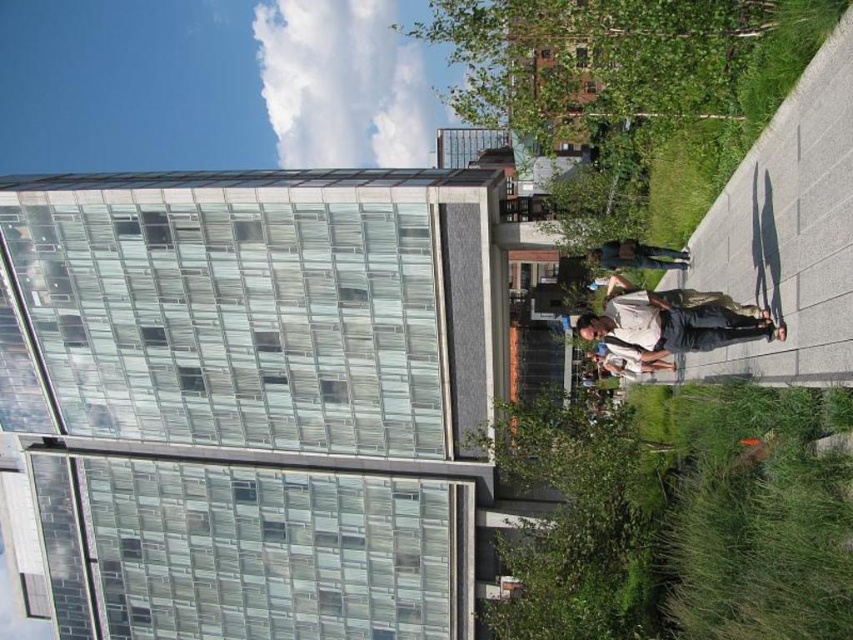
Who is lower down, khaki cotton shirt at center or dark blue jeans at center?

khaki cotton shirt at center is below.

Between point (624, 301) and point (598, 264), which one is positioned in front?

Point (624, 301) is more forward.

Which is in front, point (767, 308) or point (637, 260)?

Positioned in front is point (767, 308).

Where is `khaki cotton shirt at center`? khaki cotton shirt at center is located at coordinates (676, 298).

Is khaki cotton shirt at center positioned before white cotton shirt at center?

Yes, it is.

Is khaki cotton shirt at center below white cotton shirt at center?

Actually, khaki cotton shirt at center is above white cotton shirt at center.

Which is behind, point (654, 298) or point (665, 369)?

Point (665, 369)

Find the location of a particular element. The height and width of the screenshot is (640, 853). khaki cotton shirt at center is located at coordinates (676, 298).

Is dark blue jeans at center thinner than white cotton shirt at center?

No.

Can you confirm if dark blue jeans at center is positioned above white cotton shirt at center?

Indeed, dark blue jeans at center is positioned over white cotton shirt at center.

Between point (628, 262) and point (605, 355), which one is positioned behind?

The point (605, 355) is more distant.

Locate an element on the screen. dark blue jeans at center is located at coordinates (637, 256).